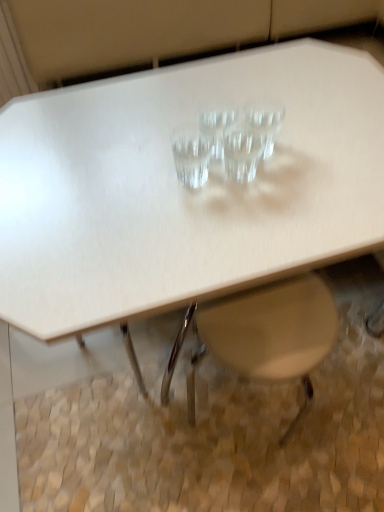
This screenshot has width=384, height=512. Find the location of `vacant area located to the right-hand side of transparent glass martini glass at center, acting as the first martini glass starting from the left`. vacant area located to the right-hand side of transparent glass martini glass at center, acting as the first martini glass starting from the left is located at coordinates (288, 176).